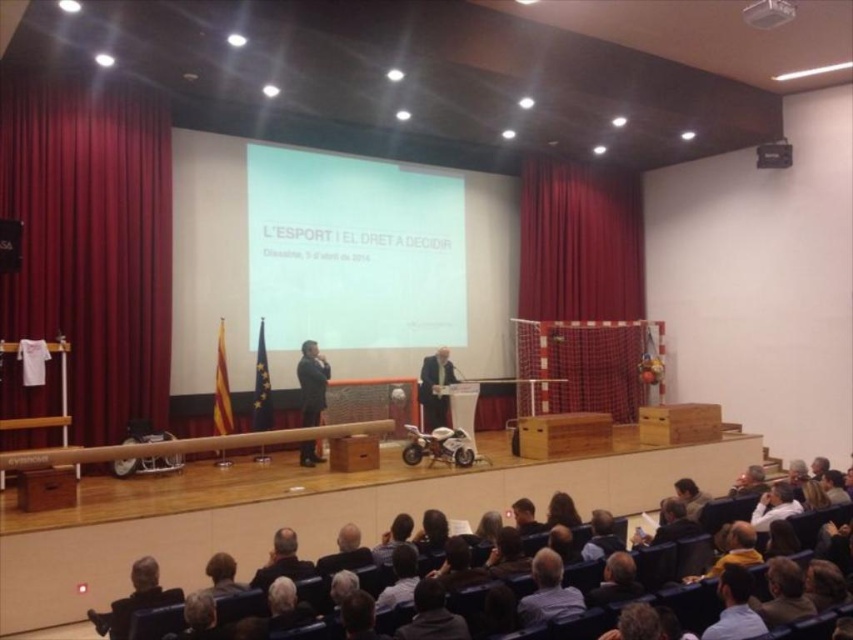
Question: Does red velvet curtain at left have a lesser width compared to curtain at center?

Choices:
 (A) no
 (B) yes

Answer: (B)

Question: Which point is farther to the camera?

Choices:
 (A) (587, 257)
 (B) (251, 248)

Answer: (A)

Question: Is white matte projection screen at center wider than dark suit at center?

Choices:
 (A) no
 (B) yes

Answer: (B)

Question: Which object appears closest to the camera in this image?

Choices:
 (A) white matte projection screen at center
 (B) dark suit at center
 (C) curtain at center

Answer: (B)

Question: Can you confirm if curtain at center is positioned below dark suit at center?

Choices:
 (A) yes
 (B) no

Answer: (B)

Question: Which of the following is the closest to the observer?

Choices:
 (A) (613, 276)
 (B) (310, 237)
 (C) (322, 372)

Answer: (C)